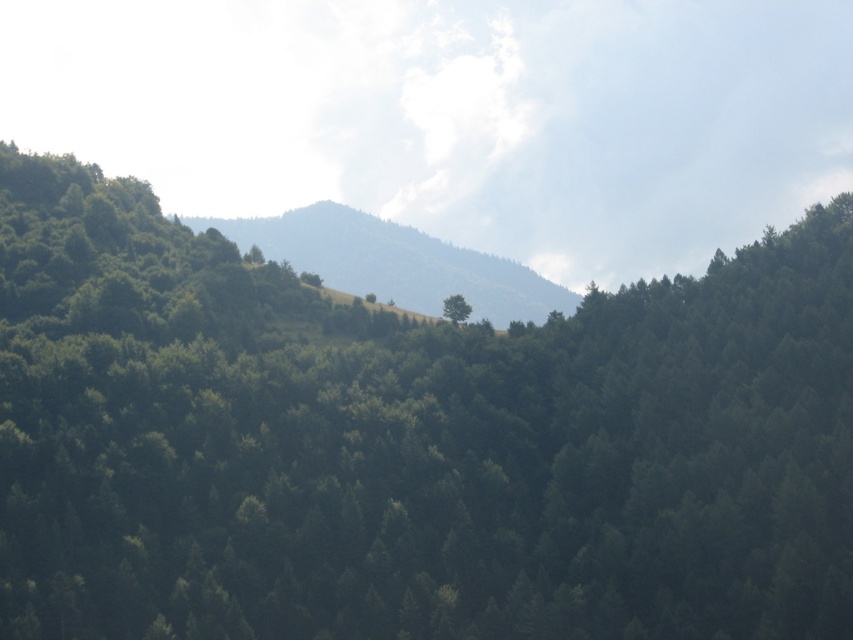
From the picture: You are standing in the forest and want to find a spot to set up a tent. The green grassy hillside at center and the green matte tree at center are both visible. Which location would provide more space for your tent?

The green grassy hillside at center has a larger size compared to the green matte tree at center, so it would provide more space for setting up a tent.

You are standing in the forest and want to reach the green grassy hillside at center. According to the coordinates provided, which direction should you walk from your current position at point (393, 262)?

The point (393, 262) is already at the green grassy hillside at center, so you are already there.